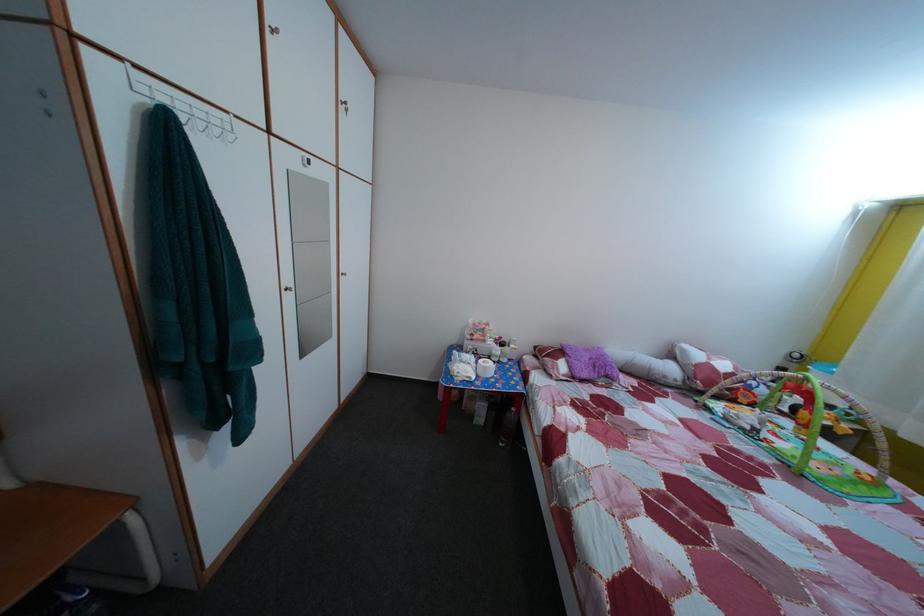
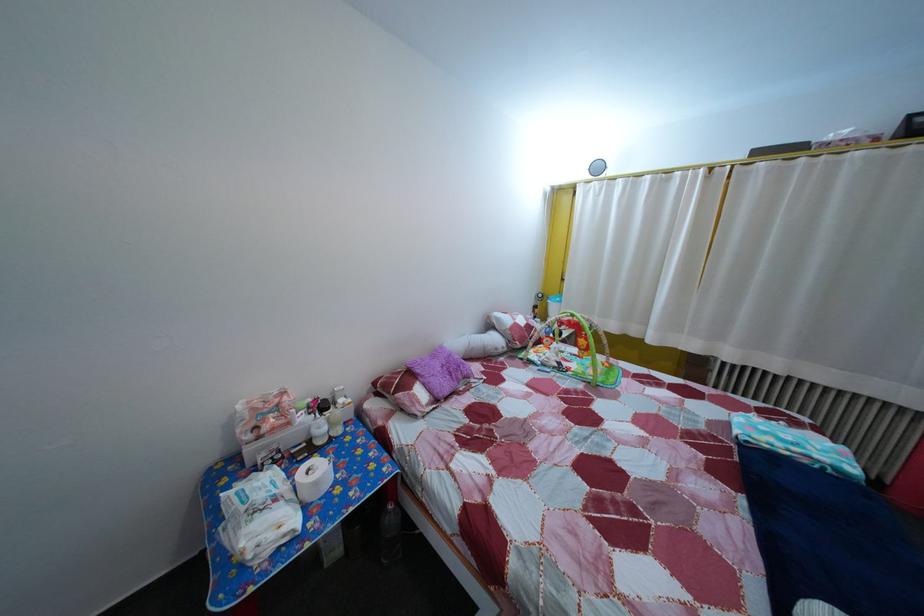
Question: The camera is either moving clockwise (left) or counter-clockwise (right) around the object. The first image is from the beginning of the video and the second image is from the end. Is the camera moving left or right when shooting the video?

Choices:
 (A) Left
 (B) Right

Answer: (A)